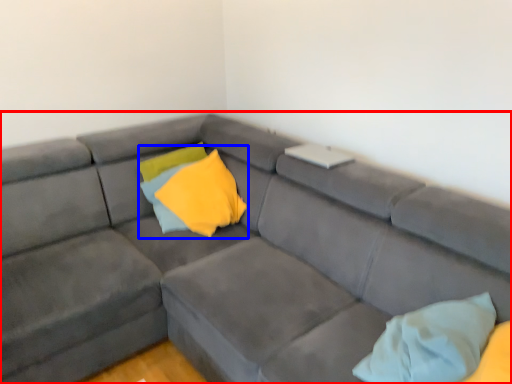
Question: Which of the following is the farthest to the observer, studio couch (highlighted by a red box) or pillow (highlighted by a blue box)?

Choices:
 (A) studio couch
 (B) pillow

Answer: (B)